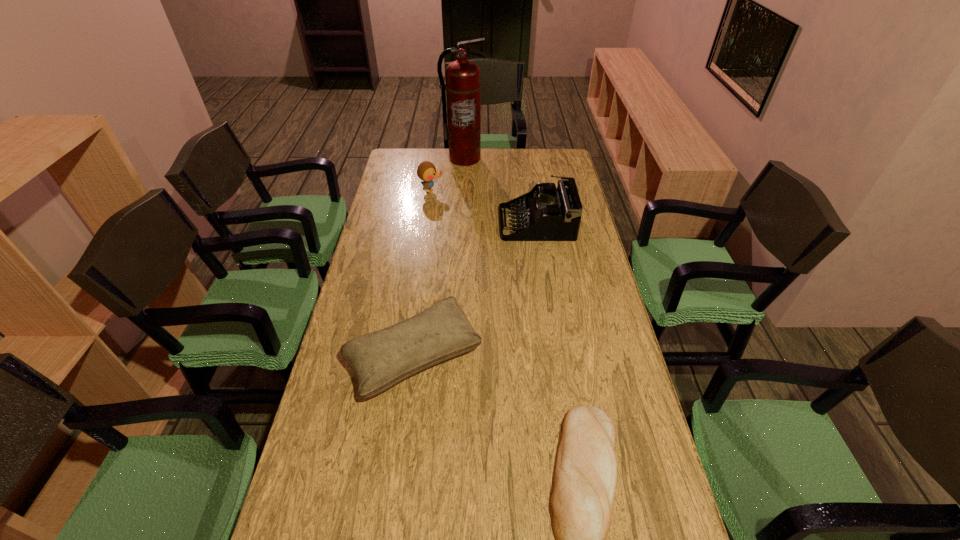
In order to click on vacant space located on the front of the fourth farthest object in this screenshot , I will do `click(398, 478)`.

In order to click on object located at the far edge in this screenshot , I will do `click(463, 77)`.

The image size is (960, 540). I want to click on duck present at the left edge, so click(426, 171).

Where is `cushion situated at the left edge`? This screenshot has width=960, height=540. cushion situated at the left edge is located at coordinates (380, 359).

Image resolution: width=960 pixels, height=540 pixels. Identify the location of object that is at the right edge. (550, 214).

The width and height of the screenshot is (960, 540). Identify the location of free region at the far edge of the desktop. (534, 157).

Locate an element on the screen. The width and height of the screenshot is (960, 540). vacant area at the left edge is located at coordinates (369, 448).

The image size is (960, 540). In the image, there is a desktop. Identify the location of free space at the right edge. (678, 536).

Where is `free space at the far right corner of the desktop`? The width and height of the screenshot is (960, 540). free space at the far right corner of the desktop is located at coordinates (562, 164).

You are a GUI agent. You are given a task and a screenshot of the screen. Output one action in this format:
    pyautogui.click(x=<x>, y=<y>)
    Task: Click on the vacant region between the cushion and the second farthest object
    The image size is (960, 540).
    Given the screenshot: What is the action you would take?
    pos(422,273)